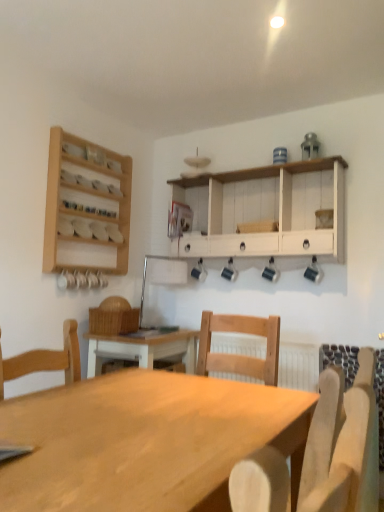
Question: Which is correct: wooden spice rack at upper left is inside white wood cabinet at upper center, or outside of it?

Choices:
 (A) outside
 (B) inside

Answer: (A)

Question: In the image, is wooden spice rack at upper left on the left side or the right side of white wood cabinet at upper center?

Choices:
 (A) left
 (B) right

Answer: (A)

Question: Estimate the real-world distances between objects in this image. Which object is farther from the wooden spice rack at upper left?

Choices:
 (A) white wood cabinet at upper center
 (B) light wood table at center
 (C) light wood chair at center

Answer: (C)

Question: Based on their relative distances, which object is farther from the light wood chair at center?

Choices:
 (A) wooden spice rack at upper left
 (B) light wood table at center
 (C) white wood cabinet at upper center

Answer: (A)